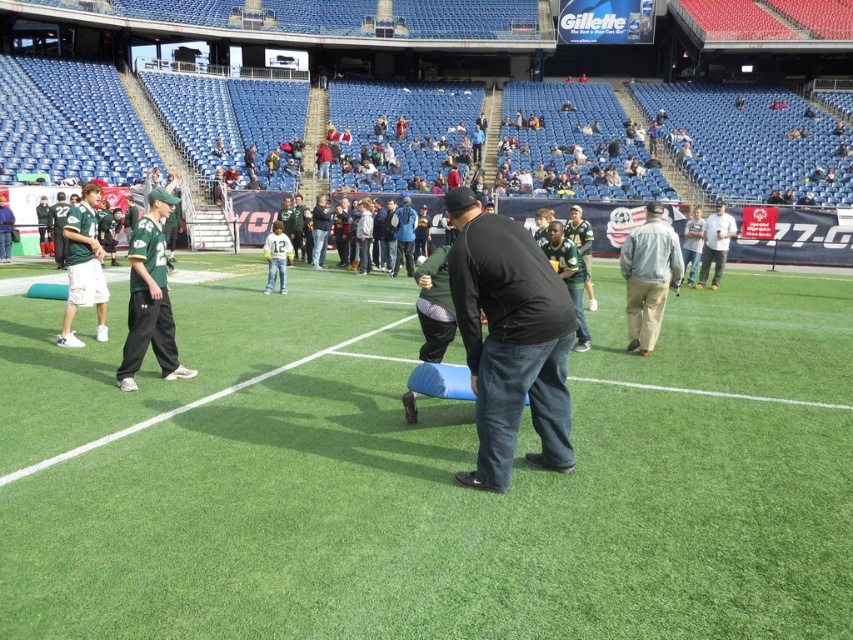
Question: Among these objects, which one is farthest from the camera?

Choices:
 (A) green artificial turf at center
 (B) green jersey at left
 (C) white cotton shirt at center
 (D) light gray jacket at center

Answer: (C)

Question: Among these points, which one is farthest from the camera?

Choices:
 (A) (94, 305)
 (B) (154, 269)
 (C) (479, 284)
 (D) (276, 259)

Answer: (D)

Question: Which object is the closest to the white cotton shirt at center?

Choices:
 (A) green artificial turf at center
 (B) light gray jacket at center
 (C) matte green jersey at left
 (D) green jersey at left

Answer: (B)

Question: Can you confirm if green jersey at left is positioned to the right of matte green jersey at left?

Choices:
 (A) no
 (B) yes

Answer: (B)

Question: Does matte green jersey at left come in front of green jersey at center?

Choices:
 (A) no
 (B) yes

Answer: (B)

Question: Where is green jersey at left located in relation to green jersey at center in the image?

Choices:
 (A) left
 (B) right

Answer: (B)